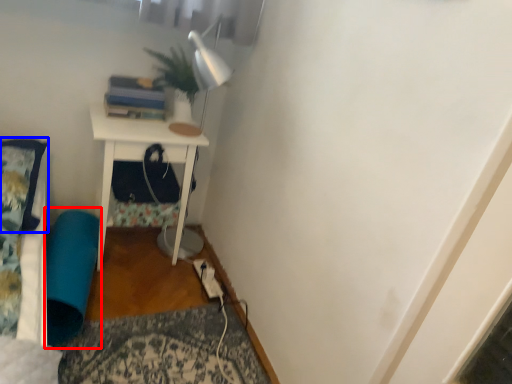
Question: Which of the following is the farthest to the observer, bean bag chair (highlighted by a red box) or pillow (highlighted by a blue box)?

Choices:
 (A) bean bag chair
 (B) pillow

Answer: (A)